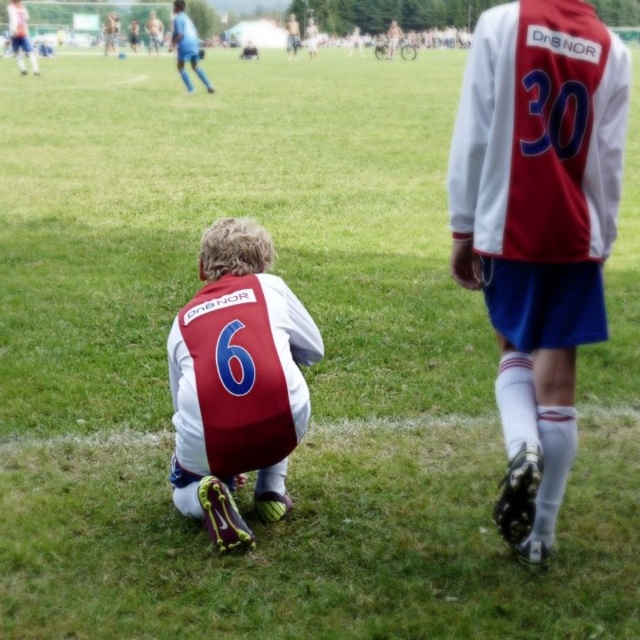
Question: Is matte red vest at lower left to the right of matte blue shorts at upper left from the viewer's perspective?

Choices:
 (A) yes
 (B) no

Answer: (A)

Question: Is matte white jersey at center bigger than matte red vest at lower left?

Choices:
 (A) no
 (B) yes

Answer: (B)

Question: Considering the relative positions of matte red vest at lower left and matte blue shorts at upper left in the image provided, where is matte red vest at lower left located with respect to matte blue shorts at upper left?

Choices:
 (A) above
 (B) below

Answer: (B)

Question: Which point is closer to the camera?

Choices:
 (A) matte white jersey at center
 (B) matte red vest at lower left
 (C) matte blue shorts at upper left

Answer: (A)

Question: Which point appears closest to the camera in this image?

Choices:
 (A) (26, 22)
 (B) (196, 74)
 (C) (253, 269)
 (D) (508, 282)

Answer: (D)

Question: Which point appears closest to the camera in this image?

Choices:
 (A) (189, 38)
 (B) (228, 344)
 (C) (531, 97)
 (D) (33, 74)

Answer: (C)